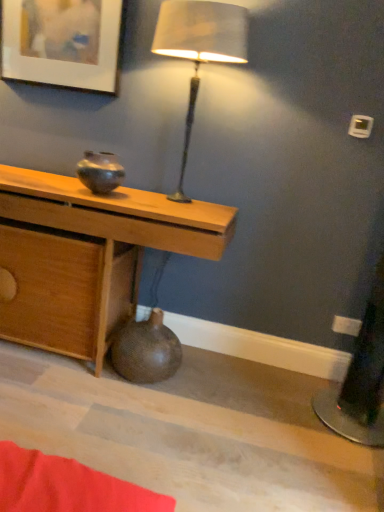
Image resolution: width=384 pixels, height=512 pixels. I want to click on vacant area that is in front of wooden desk at center, so click(x=84, y=412).